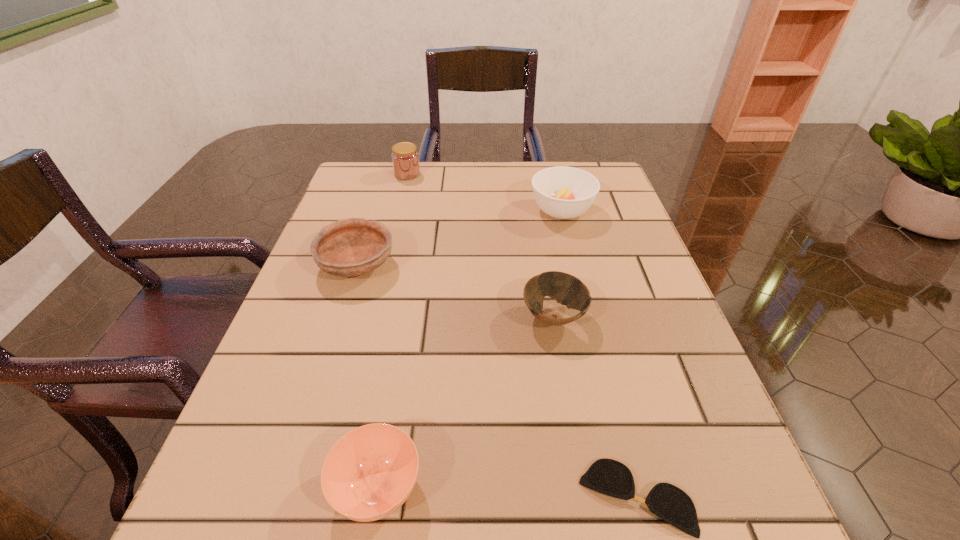
Where is `blank region between the taller soup bowl and the left bowl`? blank region between the taller soup bowl and the left bowl is located at coordinates (460, 238).

Where is `vacant space that is in between the left bowl and the shortest object`? This screenshot has height=540, width=960. vacant space that is in between the left bowl and the shortest object is located at coordinates pos(496,381).

The image size is (960, 540). What are the coordinates of `unoccupied area between the spectacles and the third farthest object` in the screenshot? It's located at (496, 381).

Identify the location of free space between the fourth farthest object and the farthest object. This screenshot has height=540, width=960. (480, 246).

Image resolution: width=960 pixels, height=540 pixels. I want to click on blank region between the fourth farthest object and the nearer soup bowl, so click(x=466, y=402).

Identify the location of unoccupied position between the shorter soup bowl and the fifth nearest object. (469, 349).

Identify the location of blank region between the jam and the taller soup bowl. (485, 192).

Where is `unoccupied area between the fifth nearest object and the nearer bowl`? This screenshot has height=540, width=960. unoccupied area between the fifth nearest object and the nearer bowl is located at coordinates (558, 264).

Where is `vacant area between the nearer bowl and the spectacles`? Image resolution: width=960 pixels, height=540 pixels. vacant area between the nearer bowl and the spectacles is located at coordinates (594, 407).

This screenshot has height=540, width=960. I want to click on free point between the fifth nearest object and the nearer soup bowl, so pos(469,349).